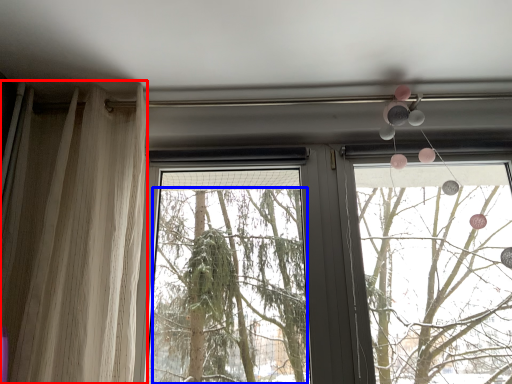
Question: Which object appears farthest to the camera in this image, curtain (highlighted by a red box) or tree (highlighted by a blue box)?

Choices:
 (A) curtain
 (B) tree

Answer: (B)